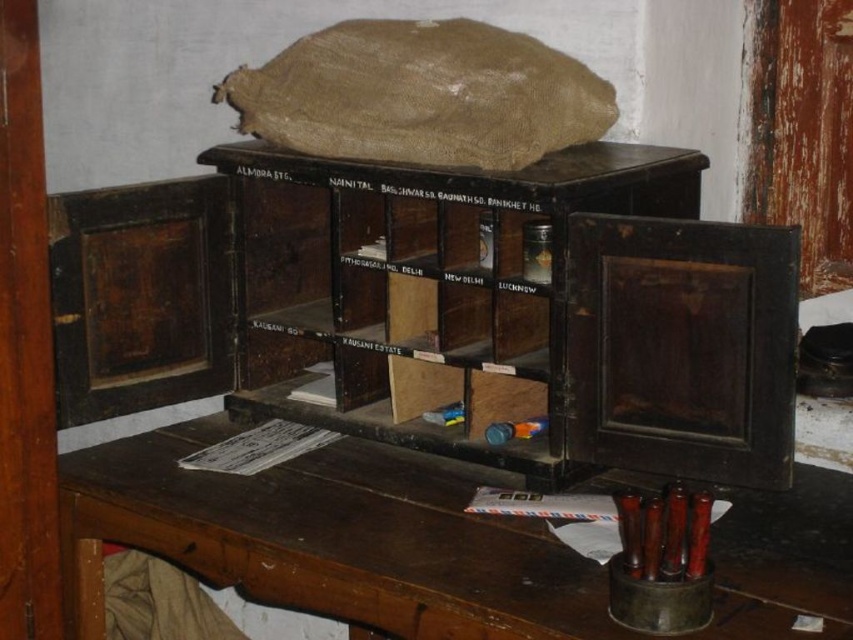
You are organizing a study area and need to place a lamp on the tallest surface available. Which object should you choose between the wooden table at center and the dark wood bookshelf at center?

The dark wood bookshelf at center is taller than the wooden table at center, so you should place the lamp on the dark wood bookshelf at center.

Looking at this image, you are standing in front of the rustic wooden cabinet with open doors. You see two points inside the cabinet labeled as point 1 at coordinates point (161, 467) and point 2 at coordinates point (335, 236). Which point is closer to you?

Point (161, 467) is in front of point (335, 236), so point (161, 467) is closer to you.

Consider the image. You are organizing items in the scene and need to place a new item on the wooden table at center. According to the scene description, where exactly is the wooden table positioned?

The wooden table at center is located at point (329, 538).